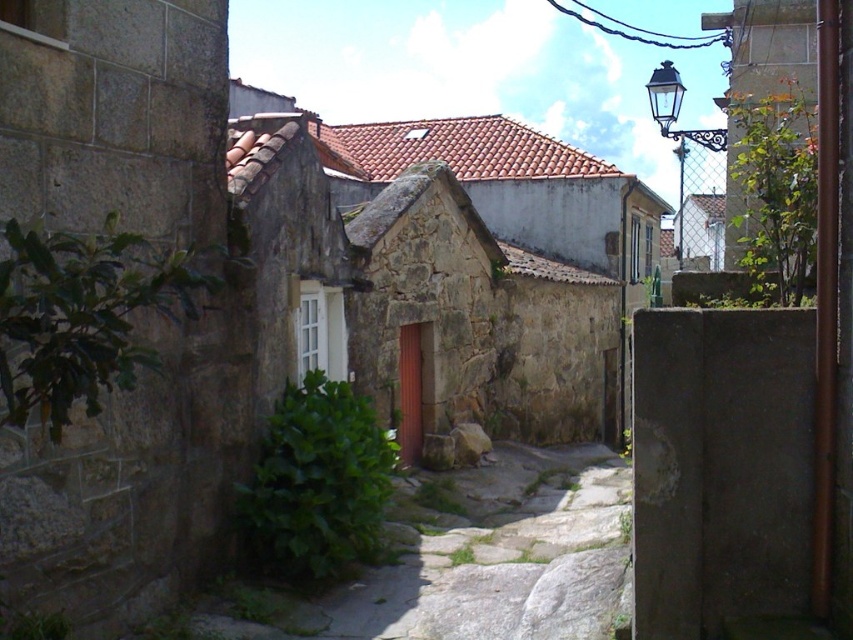
Is green mossy stone path at center shorter than black wrought iron streetlight at upper right?

Yes, green mossy stone path at center is shorter than black wrought iron streetlight at upper right.

Is point (548, 570) in front of point (674, 102)?

That is True.

This screenshot has width=853, height=640. I want to click on green mossy stone path at center, so click(x=503, y=554).